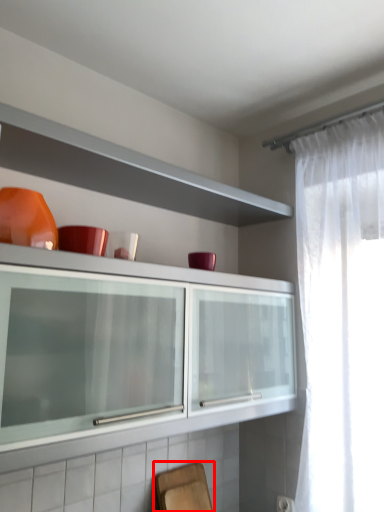
Question: From the image, what is the correct spatial relationship of chair (annotated by the red box) in relation to tableware?

Choices:
 (A) right
 (B) left

Answer: (A)